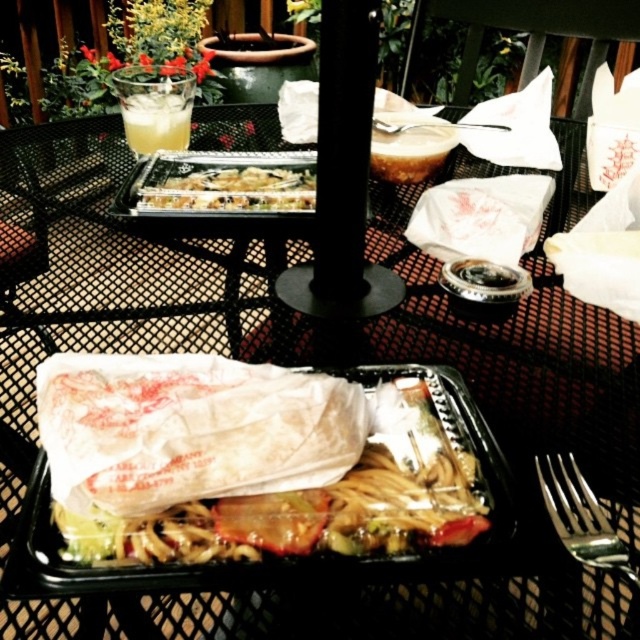
What do you see at coordinates (243, 461) in the screenshot?
I see `translucent plastic tray at center` at bounding box center [243, 461].

Can you confirm if translucent plastic tray at center is taller than silver metallic fork at lower right?

Yes.

Identify the location of translucent plastic tray at center. (243, 461).

This screenshot has width=640, height=640. In order to click on translucent plastic tray at center in this screenshot , I will do `click(243, 461)`.

Is translucent plastic tray at center smaller than clear glass cup at upper left?

Actually, translucent plastic tray at center might be larger than clear glass cup at upper left.

Describe the element at coordinates (243, 461) in the screenshot. I see `translucent plastic tray at center` at that location.

Is point (298, 470) positioned after point (172, 144)?

No, it is not.

Image resolution: width=640 pixels, height=640 pixels. Find the location of `translucent plastic tray at center`. translucent plastic tray at center is located at coordinates 243,461.

Is wooden chair at upper center wider than clear plastic container at center?

Yes, wooden chair at upper center is wider than clear plastic container at center.

Between point (465, 48) and point (208, 177), which one is positioned in front?

Point (208, 177) is more forward.

Locate an element on the screen. This screenshot has width=640, height=640. wooden chair at upper center is located at coordinates (529, 35).

Find the location of `wooden chair at upper center`. wooden chair at upper center is located at coordinates (529, 35).